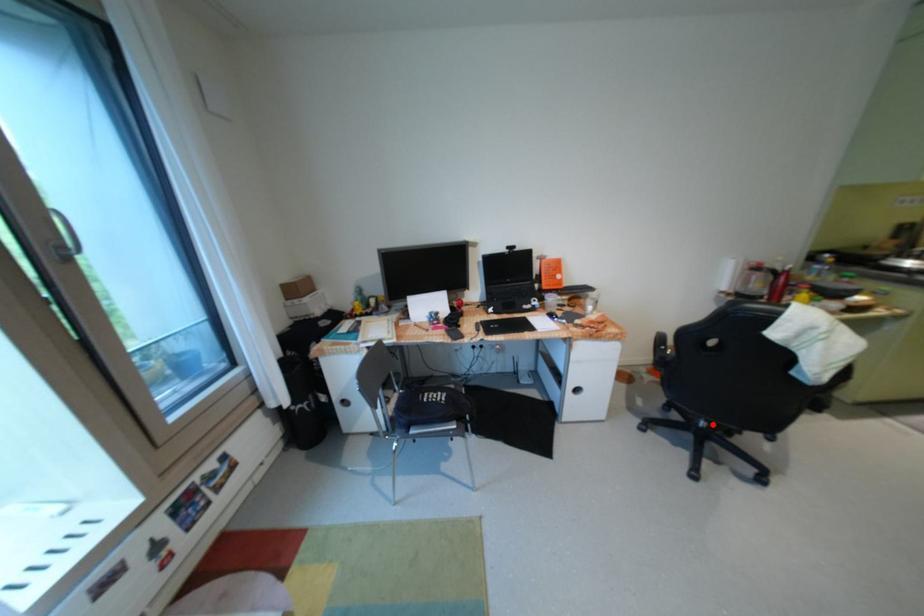
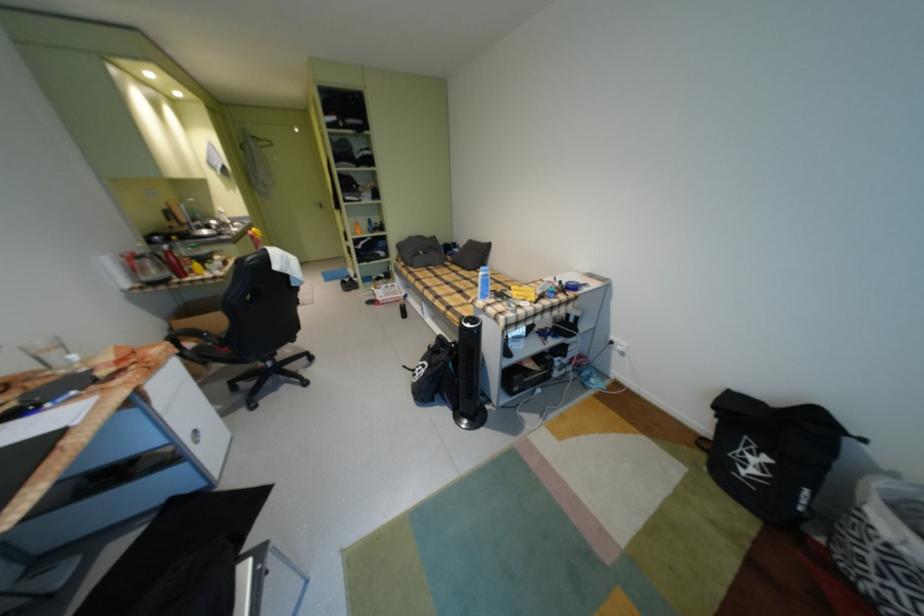
Question: I am providing you with two images of the same scene from different viewpoints. In image1, a red point is highlighted. Considering the same 3D point in image2, which of the following is correct?

Choices:
 (A) It is closer
 (B) It is farther

Answer: (A)